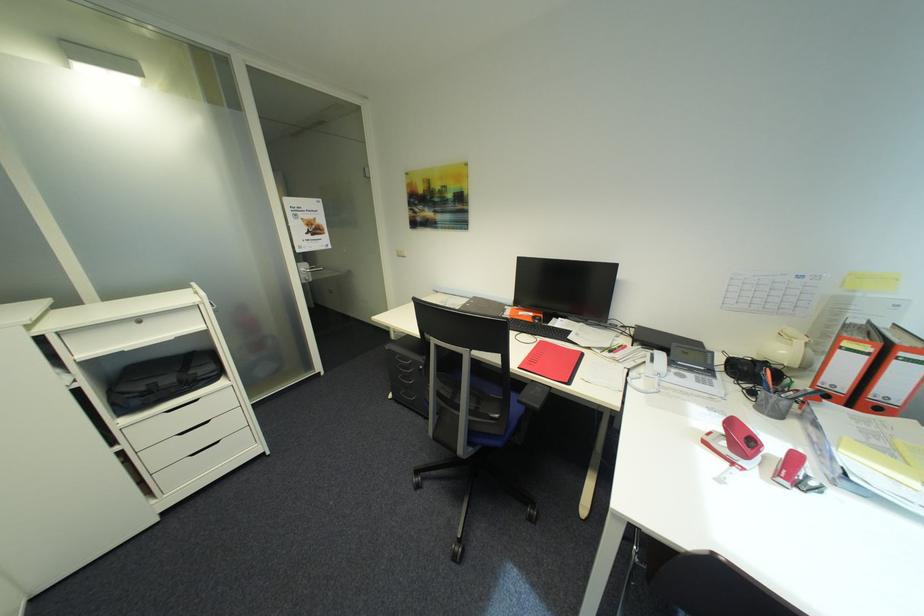
Locate an element on the screen. black chair armrest is located at coordinates (533, 395).